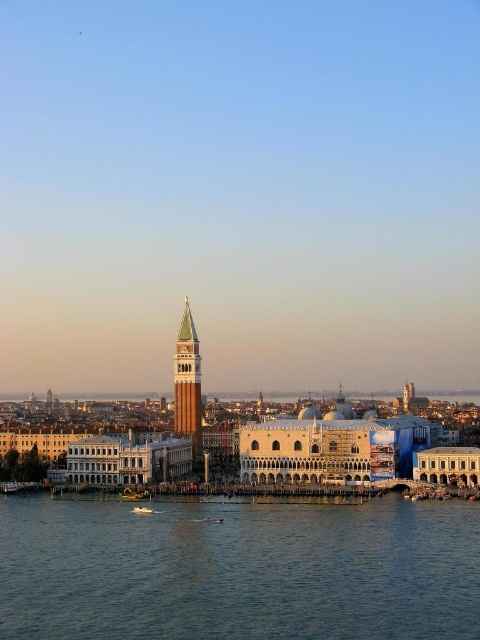
You are standing in Venice and want to take a photo of both the Campanile di San Marco and the Doge Palace. You notice two points marked in the scene. One is at point (235, 556) and the other at point (175, 356). Which point should you stand closer to in order to ensure both landmarks are in your frame?

You should stand closer to point (235, 556) because it is closer to the camera, allowing both landmarks to be in frame.

You are a tourist in Venice and want to take a photo of both the green glass bell tower at center and the white glossy boat at lower center. Based on their positions, which object should you place on the left side of your photo to include both in the frame?

To include both the green glass bell tower at center and the white glossy boat at lower center in your photo, you should place the green glass bell tower at center on the left side of your photo since it is already positioned on the left side of the white glossy boat at lower center in the scene.